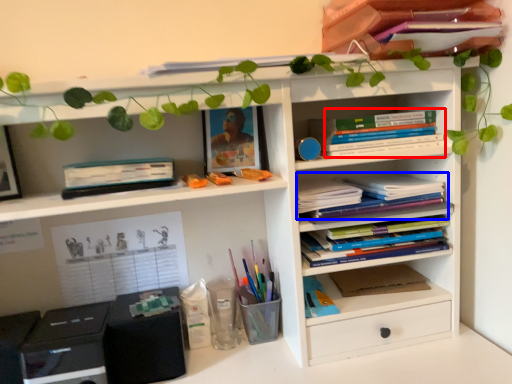
Question: Which of the following is the farthest to the observer, book (highlighted by a red box) or book (highlighted by a blue box)?

Choices:
 (A) book
 (B) book

Answer: (B)